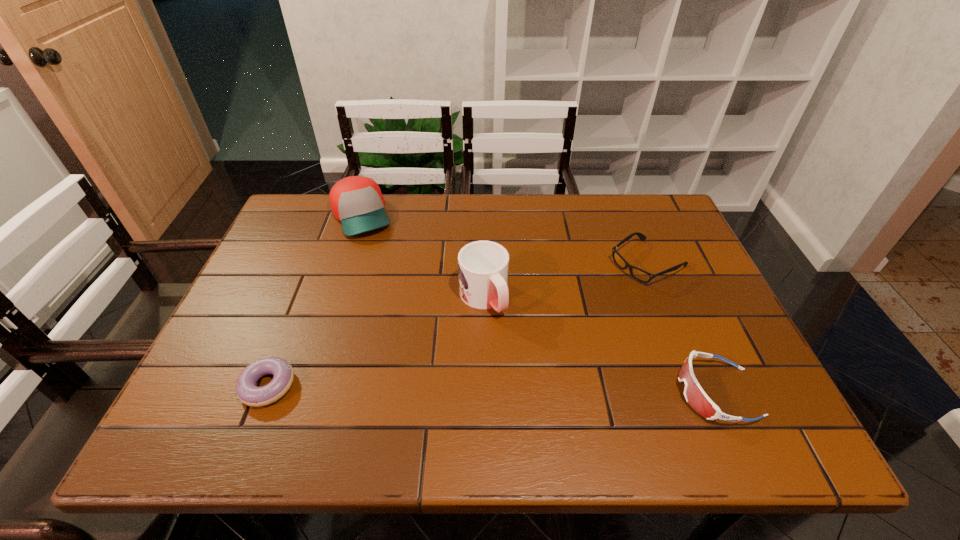
What are the coordinates of `free space located at the brim of the second tallest object` in the screenshot? It's located at (383, 269).

Image resolution: width=960 pixels, height=540 pixels. I want to click on free space located at the brim of the second tallest object, so click(409, 324).

Locate an element on the screen. The height and width of the screenshot is (540, 960). free space located at the brim of the second tallest object is located at coordinates (413, 333).

At what (x,y) coordinates should I click in order to perform the action: click on vacant point located on the front-facing side of the fourth tallest object. Please return your answer as a coordinate pair (x, y). This screenshot has width=960, height=540. Looking at the image, I should click on (548, 324).

Where is `free spot located on the front-facing side of the fourth tallest object`? free spot located on the front-facing side of the fourth tallest object is located at coordinates (610, 286).

Locate an element on the screen. This screenshot has width=960, height=540. vacant space located on the front-facing side of the fourth tallest object is located at coordinates (539, 330).

Locate an element on the screen. free space located on the side of the tallest object with the handle is located at coordinates (541, 390).

I want to click on vacant space situated on the side of the tallest object with the handle, so click(544, 395).

Identify the location of vacant space situated 0.230m on the side of the tallest object with the handle. pos(546,399).

At what (x,y) coordinates should I click in order to perform the action: click on baseball cap located in the far edge section of the desktop. Please return your answer as a coordinate pair (x, y). This screenshot has width=960, height=540. Looking at the image, I should click on (356, 201).